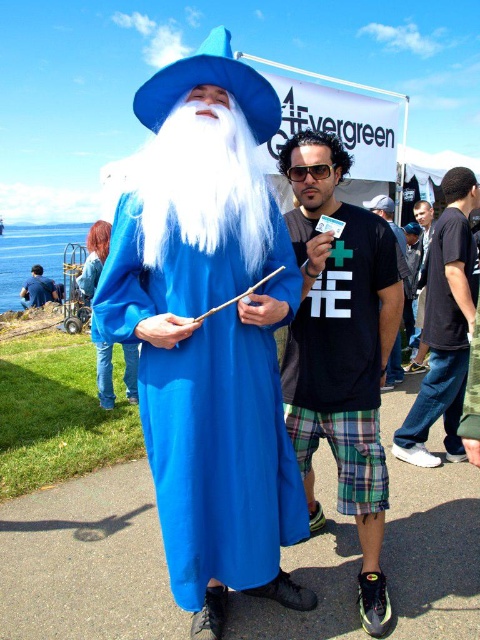
Question: Does white fluffy beard at center appear over black cotton t-shirt at center?

Choices:
 (A) no
 (B) yes

Answer: (B)

Question: Which object is farther from the camera taking this photo?

Choices:
 (A) blue fabric wizard costume at left
 (B) white fluffy beard at center
 (C) plaid shorts at center
 (D) denim shorts at center

Answer: (A)

Question: Is white fluffy beard at center closer to the viewer compared to black t-shirt at center?

Choices:
 (A) no
 (B) yes

Answer: (B)

Question: Among these points, which one is nearest to the camera?

Choices:
 (A) (420, 294)
 (B) (384, 627)
 (C) (32, 282)

Answer: (B)

Question: Is plaid shorts at center further to the viewer compared to black cotton t-shirt at center?

Choices:
 (A) yes
 (B) no

Answer: (B)

Question: Which object is closer to the camera taking this photo?

Choices:
 (A) black t-shirt at center
 (B) blue fabric wizard costume at left

Answer: (A)